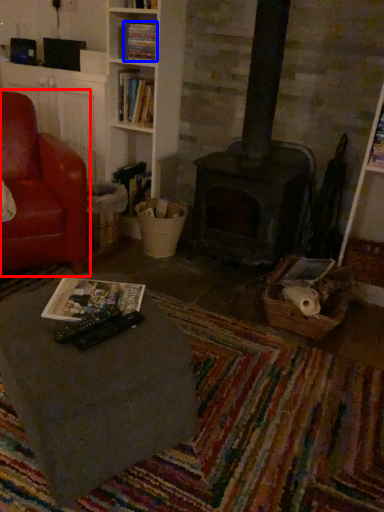
Question: Which object appears farthest to the camera in this image, chair (highlighted by a red box) or book (highlighted by a blue box)?

Choices:
 (A) chair
 (B) book

Answer: (B)